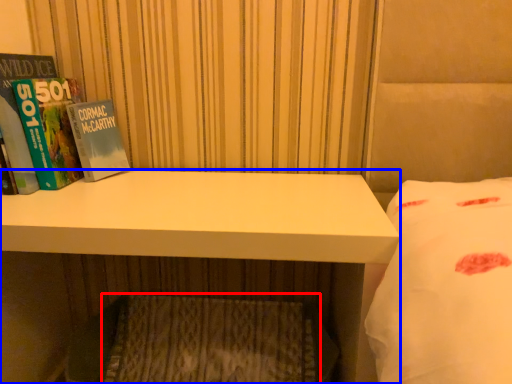
Question: Among these objects, which one is nearest to the camera, mattress (highlighted by a red box) or desk (highlighted by a blue box)?

Choices:
 (A) mattress
 (B) desk

Answer: (B)